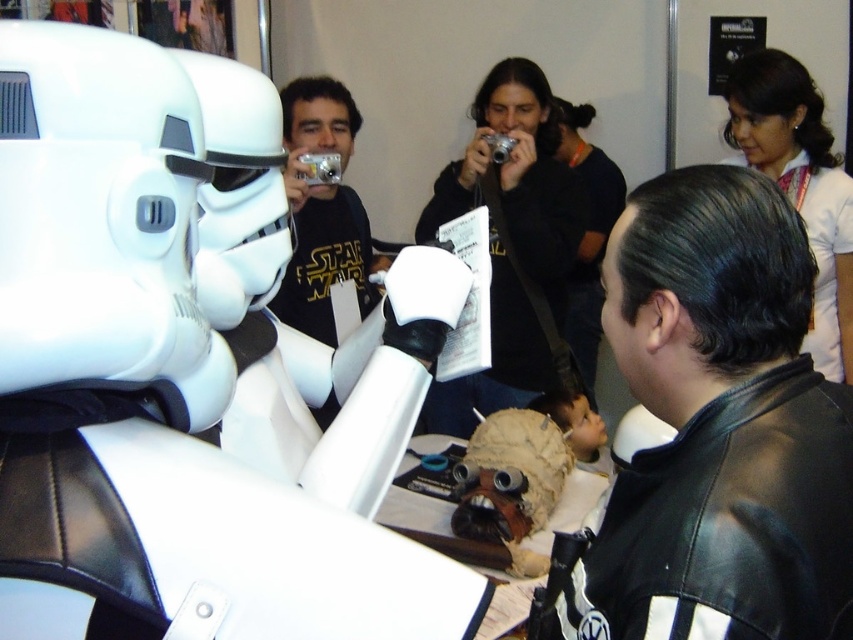
Between black leather jacket at center and smooth skin nose at upper center, which one is positioned lower?

black leather jacket at center is below.

Can you confirm if black leather jacket at center is positioned below smooth skin nose at upper center?

Correct, black leather jacket at center is located below smooth skin nose at upper center.

Where is `black leather jacket at center`? black leather jacket at center is located at coordinates (718, 428).

This screenshot has width=853, height=640. Identify the location of black leather jacket at center. (718, 428).

Is dark hair at upper center shorter than matte black nose at center?

No.

Which is more to the right, dark hair at upper center or matte black nose at center?

Positioned to the right is dark hair at upper center.

This screenshot has height=640, width=853. I want to click on dark hair at upper center, so click(x=587, y=234).

How far apart are matte black jacket at center and matte black nose at center?

matte black jacket at center is 14.06 inches away from matte black nose at center.

Is matte black jacket at center bigger than matte black nose at center?

Correct, matte black jacket at center is larger in size than matte black nose at center.

Is point (498, 225) farther from camera compared to point (503, 129)?

No, (498, 225) is in front of (503, 129).

In order to click on matte black jacket at center in this screenshot , I will do `click(511, 244)`.